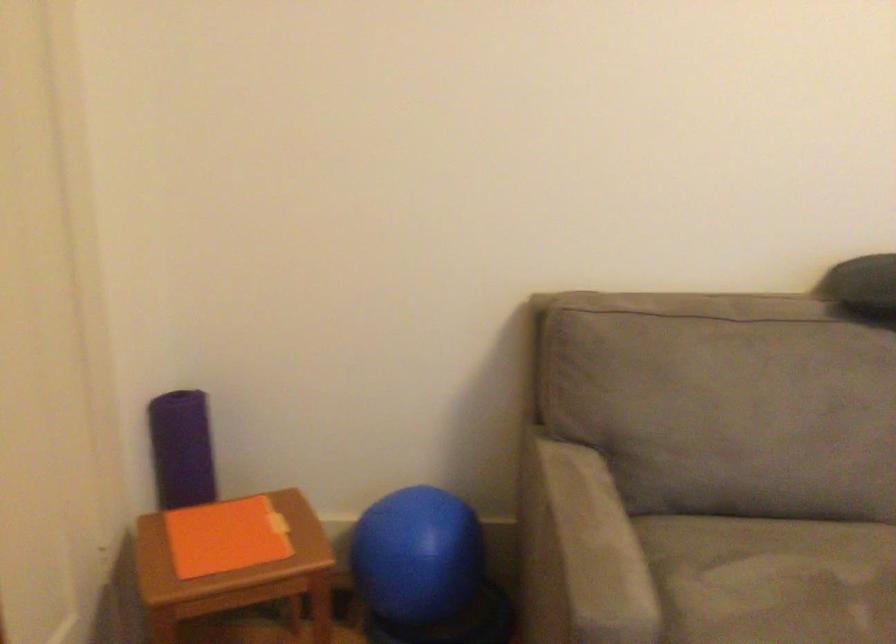
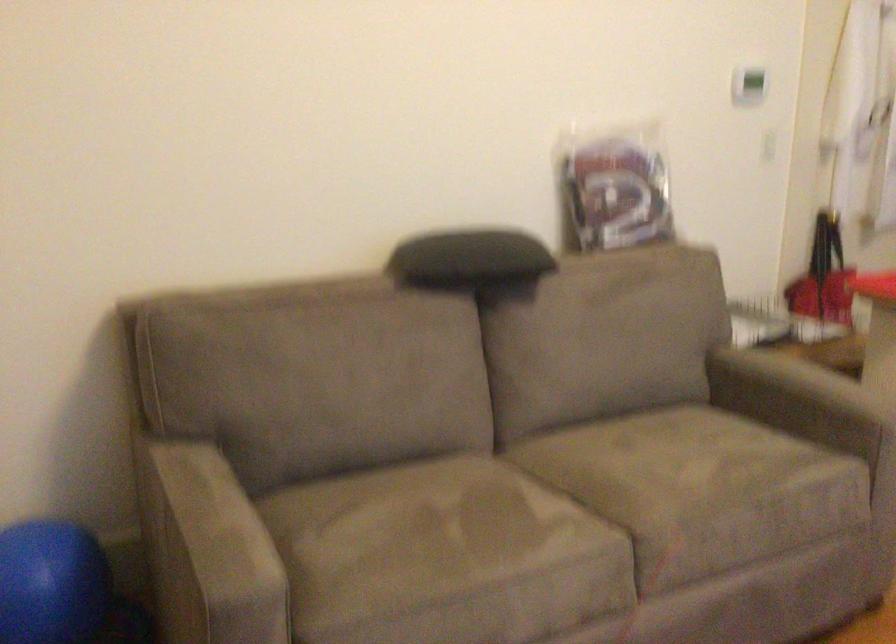
Question: The images are taken continuously from a first-person perspective. In which direction are you moving?

Choices:
 (A) Left
 (B) Right
 (C) Forward
 (D) Backward

Answer: (D)